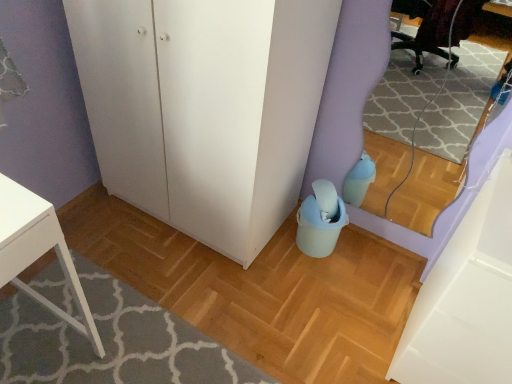
This screenshot has width=512, height=384. I want to click on vacant space to the right of matte plastic bucket at lower center, so click(307, 314).